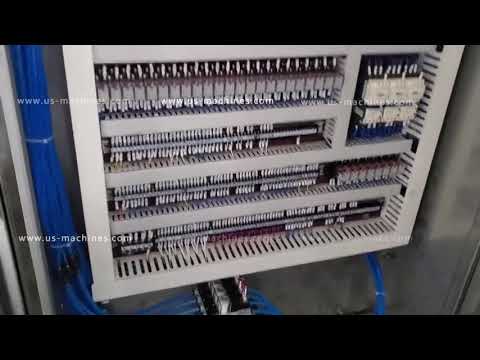
Find the location of a particular element. edge of cabinet bottom left is located at coordinates (53, 312).